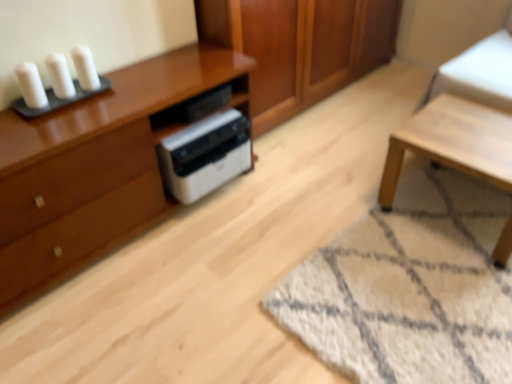
Image resolution: width=512 pixels, height=384 pixels. Describe the element at coordinates (60, 76) in the screenshot. I see `white matte candle at upper left, which ranks as the 2th candle in left-to-right order` at that location.

The width and height of the screenshot is (512, 384). What do you see at coordinates (300, 47) in the screenshot?
I see `wooden cabinet at center` at bounding box center [300, 47].

Where is `white shaggy rug at lower right`? This screenshot has height=384, width=512. white shaggy rug at lower right is located at coordinates (410, 288).

The height and width of the screenshot is (384, 512). Describe the element at coordinates (31, 85) in the screenshot. I see `white matte candle at upper left, positioned as the first candle in left-to-right order` at that location.

Describe the element at coordinates (205, 155) in the screenshot. The image size is (512, 384). I see `white plastic printer at center` at that location.

The width and height of the screenshot is (512, 384). I want to click on white matte candle at upper left, arranged as the 2th candle when viewed from the right, so click(60, 76).

Considering the positions of objects white plastic printer at center and light wood table at lower right in the image provided, who is more to the left, white plastic printer at center or light wood table at lower right?

From the viewer's perspective, white plastic printer at center appears more on the left side.

From the image's perspective, between white plastic printer at center and light wood table at lower right, which one is located above?

white plastic printer at center, from the image's perspective.

Considering the positions of point (229, 129) and point (468, 117), is point (229, 129) closer or farther from the camera than point (468, 117)?

Point (229, 129) appears to be farther away from the viewer than point (468, 117).

Consider the image. Is light wood table at lower right at the back of white plastic printer at center?

white plastic printer at center is not turned away from light wood table at lower right.

From the image's perspective, does white matte candle at upper left, marked as the 1th candle in a right-to-left arrangement, appear lower than white plastic printer at center?

Actually, white matte candle at upper left, marked as the 1th candle in a right-to-left arrangement, appears above white plastic printer at center in the image.

Considering the sizes of objects white matte candle at upper left, the third candle viewed from the left, and white plastic printer at center in the image provided, who is wider, white matte candle at upper left, the third candle viewed from the left, or white plastic printer at center?

white plastic printer at center is wider.

Which is in front, point (71, 54) or point (215, 188)?

The point (71, 54) is closer to the camera.

Is white matte candle at upper left, the third candle viewed from the left, outside of white plastic printer at center?

Yes, white matte candle at upper left, the third candle viewed from the left, is not within white plastic printer at center.

How different are the orientations of wooden cabinet at center and white matte candle at upper left, which ranks as the 2th candle in left-to-right order, in degrees?

There is a 0.0347-degree angle between the facing directions of wooden cabinet at center and white matte candle at upper left, which ranks as the 2th candle in left-to-right order.

How distant is wooden cabinet at center from white matte candle at upper left, which ranks as the 2th candle in left-to-right order?

A distance of 3.97 feet exists between wooden cabinet at center and white matte candle at upper left, which ranks as the 2th candle in left-to-right order.

Considering the relative positions of wooden cabinet at center and white matte candle at upper left, arranged as the 2th candle when viewed from the right, in the image provided, is wooden cabinet at center to the right of white matte candle at upper left, arranged as the 2th candle when viewed from the right, from the viewer's perspective?

Yes, wooden cabinet at center is to the right of white matte candle at upper left, arranged as the 2th candle when viewed from the right.

Is wooden cabinet at center far from white matte candle at upper left, which ranks as the 2th candle in left-to-right order?

Yes, wooden cabinet at center and white matte candle at upper left, which ranks as the 2th candle in left-to-right order, are located far from each other.

Is white matte candle at upper left, positioned as the first candle in left-to-right order, not within white matte candle at upper left, marked as the 1th candle in a right-to-left arrangement?

Indeed, white matte candle at upper left, positioned as the first candle in left-to-right order, is completely outside white matte candle at upper left, marked as the 1th candle in a right-to-left arrangement.

Does white matte candle at upper left, positioned as the first candle in left-to-right order, have a larger size compared to white matte candle at upper left, marked as the 1th candle in a right-to-left arrangement?

Yes.

In order to click on the 2nd candle counting from the right of the white matte candle at upper left, positioned as the first candle in left-to-right order in this screenshot , I will do `click(85, 68)`.

Can we say white shaggy rug at lower right lies outside white plastic printer at center?

white shaggy rug at lower right lies outside white plastic printer at center's area.

Does point (378, 252) appear closer or farther from the camera than point (175, 110)?

Point (378, 252) is closer to the camera than point (175, 110).

From the image's perspective, does white shaggy rug at lower right appear lower than white plastic printer at center?

Indeed, from the image's perspective, white shaggy rug at lower right is shown beneath white plastic printer at center.

Could you tell me if matte brown cabinet at left is facing light wood table at lower right?

Yes, matte brown cabinet at left is oriented towards light wood table at lower right.

Is matte brown cabinet at left further to camera compared to light wood table at lower right?

No.

Can you tell me how much matte brown cabinet at left and light wood table at lower right differ in facing direction?

89.8 degrees separate the facing orientations of matte brown cabinet at left and light wood table at lower right.

The height and width of the screenshot is (384, 512). Find the location of `chest of drawers that is on the left side of light wood table at lower right`. chest of drawers that is on the left side of light wood table at lower right is located at coordinates (95, 168).

Which is more to the left, wooden cabinet at center or white matte candle at upper left, positioned as the first candle in left-to-right order?

white matte candle at upper left, positioned as the first candle in left-to-right order.

From a real-world perspective, which object stands above the other?

white matte candle at upper left, positioned as the first candle in left-to-right order, from a real-world perspective.

From a real-world perspective, starting from the wooden cabinet at center, which candle is the 3rd one vertically above it? Please provide its 2D coordinates.

[(31, 85)]

From the image's perspective, between wooden cabinet at center and white matte candle at upper left, positioned as the first candle in left-to-right order, who is located below?

From the image's view, white matte candle at upper left, positioned as the first candle in left-to-right order, is below.

Image resolution: width=512 pixels, height=384 pixels. What are the coordinates of `table on the right of the white plastic printer at center` in the screenshot? It's located at (453, 142).

What are the coordinates of `candle that is the 1st object located in front of the white plastic printer at center` in the screenshot? It's located at (85, 68).

Based on their spatial positions, is light wood table at lower right or white plastic printer at center closer to white matte candle at upper left, marked as the 1th candle in a right-to-left arrangement?

The object closer to white matte candle at upper left, marked as the 1th candle in a right-to-left arrangement, is white plastic printer at center.

Considering their positions, is white plastic printer at center positioned further to white matte candle at upper left, acting as the third candle starting from the right, than white plastic printer at center?

white plastic printer at center lies further to white matte candle at upper left, acting as the third candle starting from the right, than the other object.

Estimate the real-world distances between objects in this image. Which object is further from light wood table at lower right, white shaggy rug at lower right or white matte candle at upper left, acting as the third candle starting from the right?

white matte candle at upper left, acting as the third candle starting from the right, lies further to light wood table at lower right than the other object.

Considering their positions, is matte brown cabinet at left positioned further to white shaggy rug at lower right than white matte candle at upper left, marked as the 1th candle in a right-to-left arrangement?

white matte candle at upper left, marked as the 1th candle in a right-to-left arrangement, is further to white shaggy rug at lower right.

Looking at the image, which one is located further to white shaggy rug at lower right, light wood table at lower right or white matte candle at upper left, positioned as the first candle in left-to-right order?

Among the two, white matte candle at upper left, positioned as the first candle in left-to-right order, is located further to white shaggy rug at lower right.

Looking at the image, which one is located closer to white plastic printer at center, white matte candle at upper left, arranged as the 2th candle when viewed from the right, or matte brown cabinet at left?

Among the two, matte brown cabinet at left is located nearer to white plastic printer at center.

From the picture: From the image, which object appears to be farther from white matte candle at upper left, acting as the third candle starting from the right, white plastic printer at center or white shaggy rug at lower right?

white shaggy rug at lower right.

When comparing their distances from white matte candle at upper left, marked as the 1th candle in a right-to-left arrangement, does white plastic printer at center or white plastic printer at center seem further?

Based on the image, white plastic printer at center appears to be further to white matte candle at upper left, marked as the 1th candle in a right-to-left arrangement.

Image resolution: width=512 pixels, height=384 pixels. Find the location of `the chest of drawers situated between white matte candle at upper left, the third candle viewed from the left, and wooden cabinet at center from left to right`. the chest of drawers situated between white matte candle at upper left, the third candle viewed from the left, and wooden cabinet at center from left to right is located at coordinates (95, 168).

You are a GUI agent. You are given a task and a screenshot of the screen. Output one action in this format:
    pyautogui.click(x=<x>, y=<y>)
    Task: Click on the home appliance situated between white matte candle at upper left, arranged as the 2th candle when viewed from the right, and white shaggy rug at lower right from left to right
    The image size is (512, 384).
    Given the screenshot: What is the action you would take?
    pyautogui.click(x=205, y=155)

At what (x,y) coordinates should I click in order to perform the action: click on appliance between white matte candle at upper left, positioned as the first candle in left-to-right order, and wooden cabinet at center from left to right. Please return your answer as a coordinate pair (x, y). The image size is (512, 384). Looking at the image, I should click on (193, 108).

At what (x,y) coordinates should I click in order to perform the action: click on chest of drawers between white matte candle at upper left, positioned as the first candle in left-to-right order, and light wood table at lower right, in the horizontal direction. Please return your answer as a coordinate pair (x, y). The width and height of the screenshot is (512, 384). Looking at the image, I should click on (95, 168).